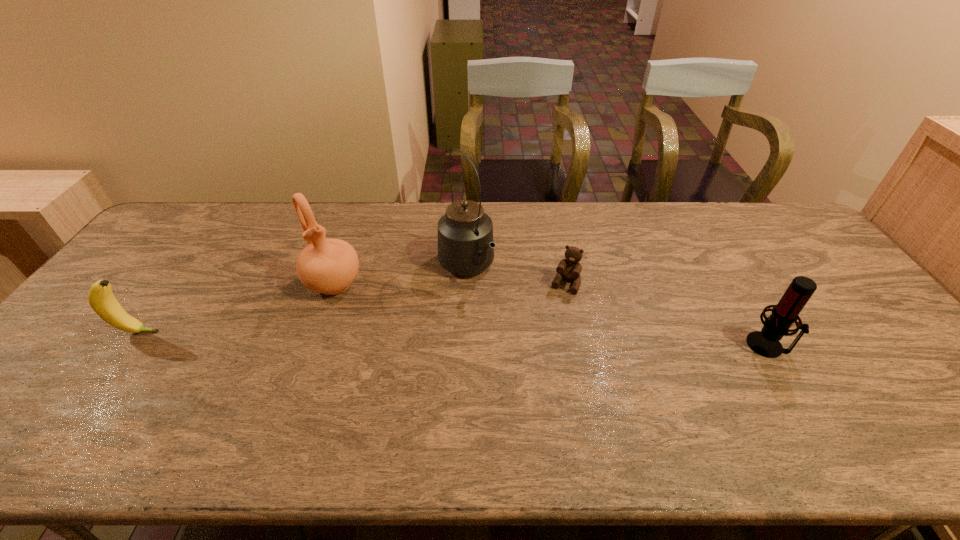
Locate an element on the screen. Image resolution: width=960 pixels, height=540 pixels. free space on the desktop that is between the banana and the microphone and is positioned on the spout of the second tallest object is located at coordinates (371, 336).

In order to click on vacant space on the desktop that is between the fourth tallest object and the microphone and is positioned on the face of the shortest object in this screenshot , I will do `click(539, 340)`.

Find the location of a particular element. This screenshot has width=960, height=540. free spot on the desktop that is between the leftmost object and the third tallest object and is positioned spout on the tallest object is located at coordinates (529, 340).